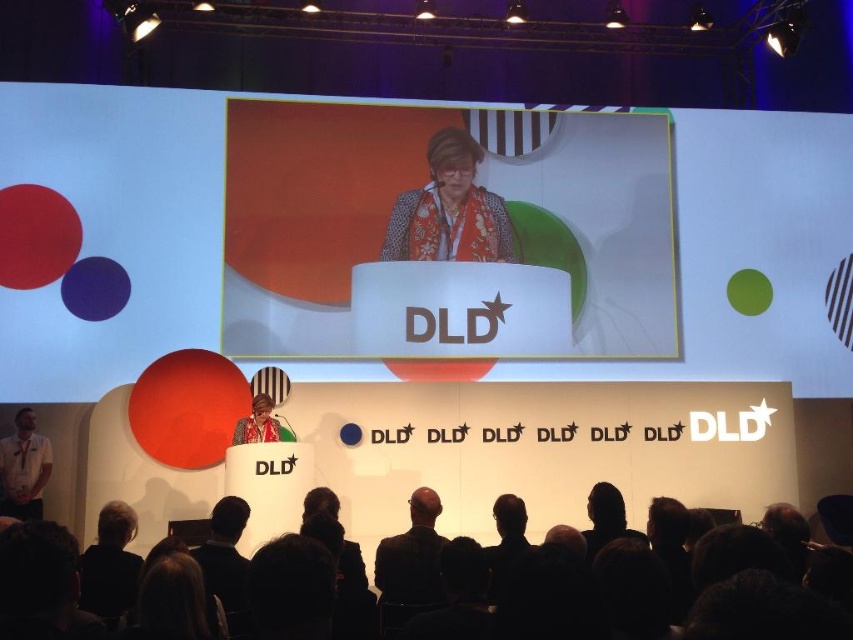
Question: Considering the real-world distances, which object is closest to the white shirt at lower left?

Choices:
 (A) matte red scarf at center
 (B) printed scarf at center
 (C) black suit at center

Answer: (A)

Question: Which of the following is the farthest from the observer?

Choices:
 (A) [x=628, y=572]
 (B) [x=45, y=440]
 (C) [x=260, y=413]
 (D) [x=445, y=253]

Answer: (D)

Question: Which object is positioned closest to the black fabric at lower center?

Choices:
 (A) white shirt at lower left
 (B) black suit at center
 (C) matte red scarf at center
 (D) printed scarf at center

Answer: (B)

Question: Does black suit at center have a larger size compared to matte red scarf at center?

Choices:
 (A) yes
 (B) no

Answer: (B)

Question: Can you confirm if black fabric at lower center is positioned to the right of printed scarf at center?

Choices:
 (A) yes
 (B) no

Answer: (A)

Question: Observing the image, what is the correct spatial positioning of black fabric at lower center in reference to black suit at center?

Choices:
 (A) above
 (B) below

Answer: (A)